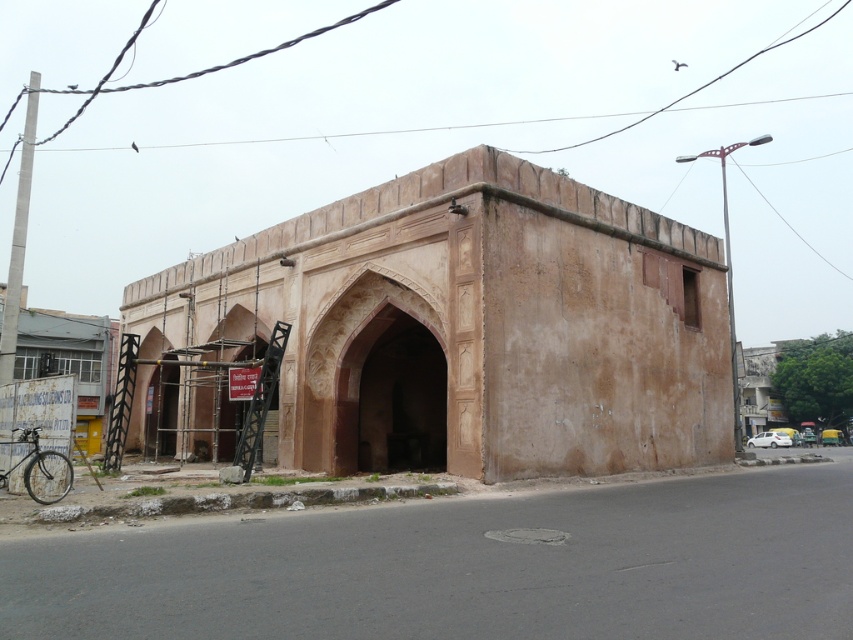
Question: Which object is the farthest from the brown stone archway at center?

Choices:
 (A) brown rough stone archway at center
 (B) black matte bicycle at lower left

Answer: (B)

Question: Considering the relative positions of brown stone archway at center and black matte bicycle at lower left in the image provided, where is brown stone archway at center located with respect to black matte bicycle at lower left?

Choices:
 (A) below
 (B) above

Answer: (A)

Question: Where is brown stone archway at center located in relation to black matte bicycle at lower left in the image?

Choices:
 (A) below
 (B) above

Answer: (A)

Question: Among these objects, which one is nearest to the camera?

Choices:
 (A) brown rough stone archway at center
 (B) brown stone archway at center
 (C) black matte bicycle at lower left

Answer: (C)

Question: Can you confirm if brown rough stone archway at center is thinner than brown stone archway at center?

Choices:
 (A) yes
 (B) no

Answer: (B)

Question: Estimate the real-world distances between objects in this image. Which object is farther from the brown rough stone archway at center?

Choices:
 (A) brown stone archway at center
 (B) black matte bicycle at lower left

Answer: (B)